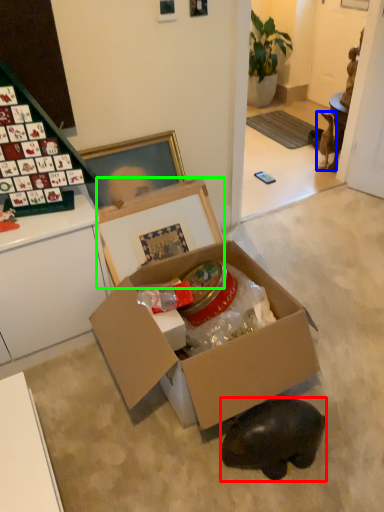
Question: Which is farther away from animal (highlighted by a red box)? animal (highlighted by a blue box) or cardboard box (highlighted by a green box)?

Choices:
 (A) animal
 (B) cardboard box

Answer: (A)